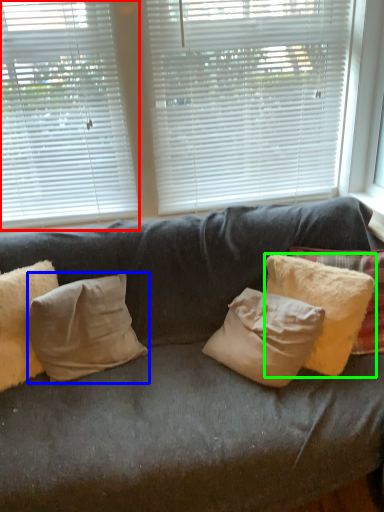
Question: Considering the real-world distances, which object is closest to window blind (highlighted by a red box)? pillow (highlighted by a blue box) or pillow (highlighted by a green box).

Choices:
 (A) pillow
 (B) pillow

Answer: (A)